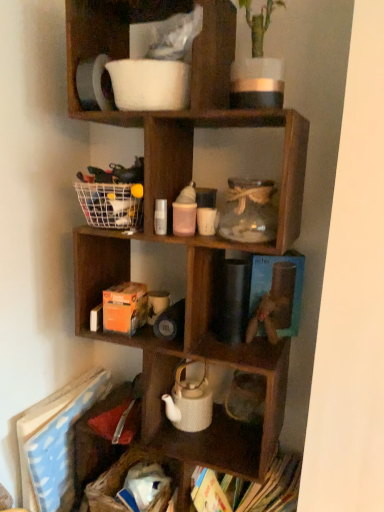
Describe the element at coordinates (214, 56) in the screenshot. I see `white matte pitcher at upper center, placed as the first shelf when sorted from top to bottom` at that location.

Locate an element on the screen. The height and width of the screenshot is (512, 384). white textured teapot at center is located at coordinates (189, 402).

In order to face wooden cube at center, acting as the 2th shelf starting from the top, should I rotate leftwards or rightwards?

It's best to rotate left around 0.760 degrees.

At what (x,y) coordinates should I click in order to perform the action: click on wooden cube at center, acting as the 2th shelf starting from the top. Please return your answer as a coordinate pair (x, y). The width and height of the screenshot is (384, 512). Looking at the image, I should click on (188, 241).

Where is `blue paper book at lower left, which is the second book from right to left`? blue paper book at lower left, which is the second book from right to left is located at coordinates (55, 443).

You are a GUI agent. You are given a task and a screenshot of the screen. Output one action in this format:
    pyautogui.click(x=<x>, y=<y>)
    Task: Click on the hardcover book at bottom right, which appears as the second book when viewed from the left
    Image resolution: width=384 pixels, height=512 pixels.
    Given the screenshot: What is the action you would take?
    pyautogui.click(x=275, y=487)

Where is `wooden toy at center`? wooden toy at center is located at coordinates (275, 304).

From the image's perspective, relative to white textured teapot at center, is hardcover book at bottom right, which is the 1th book in right-to-left order, above or below?

From the image's perspective, hardcover book at bottom right, which is the 1th book in right-to-left order, appears below white textured teapot at center.

Considering the sizes of objects hardcover book at bottom right, which appears as the second book when viewed from the left, and white textured teapot at center in the image provided, who is bigger, hardcover book at bottom right, which appears as the second book when viewed from the left, or white textured teapot at center?

hardcover book at bottom right, which appears as the second book when viewed from the left.

Identify the location of tea pot on the left of hardcover book at bottom right, which appears as the second book when viewed from the left. (189, 402).

Is blue paper book at lower left, which is the second book from right to left, directly adjacent to wooden toy at center?

No, blue paper book at lower left, which is the second book from right to left, is not beside wooden toy at center.

Is blue paper book at lower left, which is counted as the 1th book, starting from the left, inside or outside of wooden toy at center?

The correct answer is: outside.

Does blue paper book at lower left, which is the second book from right to left, have a larger size compared to wooden toy at center?

Correct, blue paper book at lower left, which is the second book from right to left, is larger in size than wooden toy at center.

Does white woven basket at lower left lie in front of wooden toy at center?

That is True.

Where is `toy behind the white woven basket at lower left`? The height and width of the screenshot is (512, 384). toy behind the white woven basket at lower left is located at coordinates point(275,304).

Between white woven basket at lower left and wooden toy at center, which one has smaller size?

wooden toy at center.

Is wooden cube at center, acting as the 2th shelf starting from the top, turned away from white textured teapot at center?

Yes, wooden cube at center, acting as the 2th shelf starting from the top,'s orientation is away from white textured teapot at center.

Considering the positions of points (158, 163) and (183, 419), is point (158, 163) closer to camera compared to point (183, 419)?

Yes, it is in front of point (183, 419).

Is wooden cube at center, placed as the first shelf when sorted from bottom to top, to the left or to the right of white textured teapot at center in the image?

wooden cube at center, placed as the first shelf when sorted from bottom to top, is to the left of white textured teapot at center.

Locate an element on the screen. The image size is (384, 512). shelf that is the 2nd one when counting forward from the white textured teapot at center is located at coordinates (188, 241).

Between point (203, 393) and point (158, 498), which one is positioned in front?

The point (158, 498) is closer.

Is white textured teapot at center positioned with its back to white woven basket at lower left?

No.

From a real-world perspective, is white textured teapot at center located higher than white woven basket at lower left?

Yes, from a real-world perspective, white textured teapot at center is above white woven basket at lower left.

From the image's perspective, does wooden cube at center, acting as the 2th shelf starting from the top, appear higher than white matte pitcher at upper center, which is the second shelf in bottom-to-top order?

No.

Does wooden cube at center, placed as the first shelf when sorted from bottom to top, have a lesser width compared to white matte pitcher at upper center, placed as the first shelf when sorted from top to bottom?

Incorrect, the width of wooden cube at center, placed as the first shelf when sorted from bottom to top, is not less than that of white matte pitcher at upper center, placed as the first shelf when sorted from top to bottom.

Considering the sizes of wooden cube at center, acting as the 2th shelf starting from the top, and white matte pitcher at upper center, placed as the first shelf when sorted from top to bottom, in the image, is wooden cube at center, acting as the 2th shelf starting from the top, bigger or smaller than white matte pitcher at upper center, placed as the first shelf when sorted from top to bottom,?

Considering their sizes, wooden cube at center, acting as the 2th shelf starting from the top, takes up more space than white matte pitcher at upper center, placed as the first shelf when sorted from top to bottom.

Would you say hardcover book at bottom right, which appears as the second book when viewed from the left, is inside or outside white matte pitcher at upper center, which is the second shelf in bottom-to-top order?

hardcover book at bottom right, which appears as the second book when viewed from the left, is spatially situated outside white matte pitcher at upper center, which is the second shelf in bottom-to-top order.

Is hardcover book at bottom right, which is the 1th book in right-to-left order, with white matte pitcher at upper center, which is the second shelf in bottom-to-top order?

No.

Which object is closer to the camera, hardcover book at bottom right, which is the 1th book in right-to-left order, or white matte pitcher at upper center, which is the second shelf in bottom-to-top order?

white matte pitcher at upper center, which is the second shelf in bottom-to-top order, is more forward.

At what (x,y) coordinates should I click in order to perform the action: click on book in front of the white textured teapot at center. Please return your answer as a coordinate pair (x, y). The width and height of the screenshot is (384, 512). Looking at the image, I should click on (275, 487).

Identify the location of toy that appears above the blue paper book at lower left, which is counted as the 1th book, starting from the left (from a real-world perspective). The height and width of the screenshot is (512, 384). (275, 304).

Based on the photo, considering their positions, is white woven basket at lower left positioned closer to white matte pitcher at upper center, placed as the first shelf when sorted from top to bottom, than wooden cube at center, placed as the first shelf when sorted from bottom to top?

wooden cube at center, placed as the first shelf when sorted from bottom to top, is positioned closer to the anchor white matte pitcher at upper center, placed as the first shelf when sorted from top to bottom.

Looking at the image, which one is located closer to white textured teapot at center, white woven basket at lower left or hardcover book at bottom right, which is the 1th book in right-to-left order?

The object closer to white textured teapot at center is white woven basket at lower left.

When comparing their distances from wooden toy at center, does blue paper book at lower left, which is counted as the 1th book, starting from the left, or hardcover book at bottom right, which is the 1th book in right-to-left order, seem closer?

Based on the image, hardcover book at bottom right, which is the 1th book in right-to-left order, appears to be nearer to wooden toy at center.

Considering their positions, is wooden toy at center positioned closer to blue paper book at lower left, which is the second book from right to left, than white woven basket at lower left?

Among the two, white woven basket at lower left is located nearer to blue paper book at lower left, which is the second book from right to left.

Based on their spatial positions, is white woven basket at lower left or wooden toy at center further from white textured teapot at center?

Based on the image, wooden toy at center appears to be further to white textured teapot at center.

Looking at the image, which one is located further to white matte pitcher at upper center, which is the second shelf in bottom-to-top order, wooden cube at center, acting as the 2th shelf starting from the top, or white textured teapot at center?

white textured teapot at center lies further to white matte pitcher at upper center, which is the second shelf in bottom-to-top order, than the other object.

Looking at the image, which one is located further to blue paper book at lower left, which is the second book from right to left, white matte pitcher at upper center, placed as the first shelf when sorted from top to bottom, or white woven basket at lower left?

Among the two, white matte pitcher at upper center, placed as the first shelf when sorted from top to bottom, is located further to blue paper book at lower left, which is the second book from right to left.

Based on their spatial positions, is white textured teapot at center or wooden toy at center further from white woven basket at lower left?

The object further to white woven basket at lower left is wooden toy at center.

The image size is (384, 512). In order to click on book that lies between white matte pitcher at upper center, which is the second shelf in bottom-to-top order, and white woven basket at lower left from top to bottom in this screenshot , I will do `click(55, 443)`.

Image resolution: width=384 pixels, height=512 pixels. I want to click on shelf between wooden toy at center and hardcover book at bottom right, which appears as the second book when viewed from the left, vertically, so click(188, 241).

The image size is (384, 512). Identify the location of toy between wooden cube at center, placed as the first shelf when sorted from bottom to top, and white textured teapot at center from front to back. (275, 304).

Where is `toy between white matte pitcher at upper center, placed as the first shelf when sorted from top to bottom, and white textured teapot at center from top to bottom`? toy between white matte pitcher at upper center, placed as the first shelf when sorted from top to bottom, and white textured teapot at center from top to bottom is located at coordinates (275, 304).